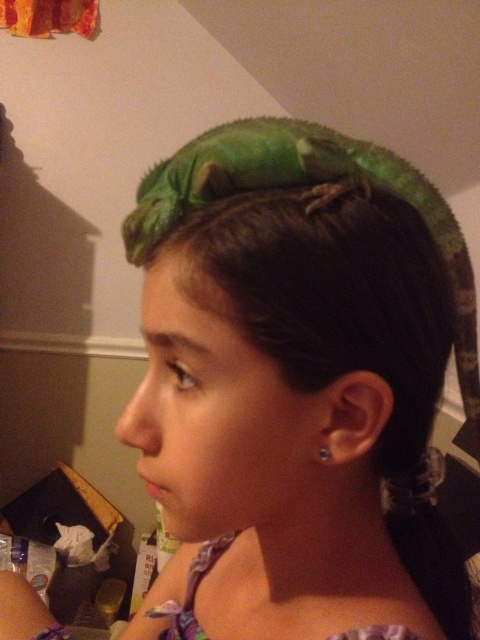
Is green scaly lizard at upper center bigger than clear plastic earring at ear?

Yes.

Who is more distant from viewer, (255, 156) or (324, 452)?

Positioned behind is point (324, 452).

Is point (465, 364) less distant than point (321, 451)?

No.

Identify the location of green scaly lizard at upper center. (314, 198).